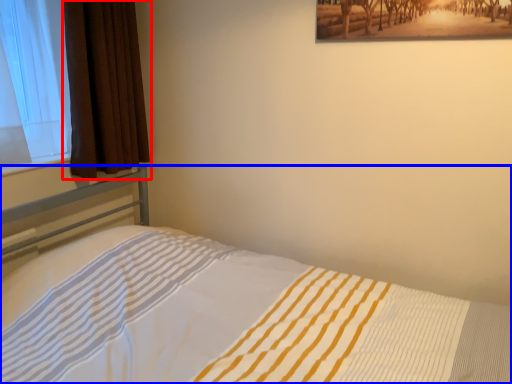
Question: Among these objects, which one is nearest to the camera, curtain (highlighted by a red box) or bed (highlighted by a blue box)?

Choices:
 (A) curtain
 (B) bed

Answer: (B)